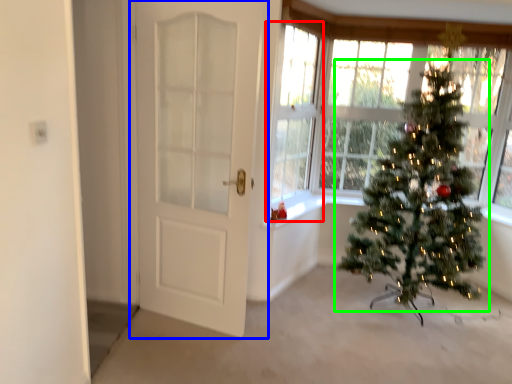
Question: Considering the real-world distances, which object is closest to window (highlighted by a red box)? door (highlighted by a blue box) or christmas tree (highlighted by a green box).

Choices:
 (A) door
 (B) christmas tree

Answer: (A)